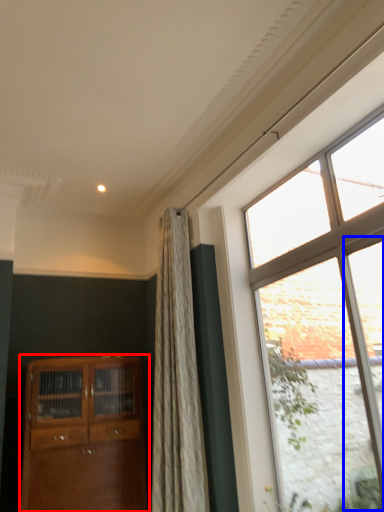
Question: Among these objects, which one is farthest to the camera, cabinetry (highlighted by a red box) or glass door (highlighted by a blue box)?

Choices:
 (A) cabinetry
 (B) glass door

Answer: (A)